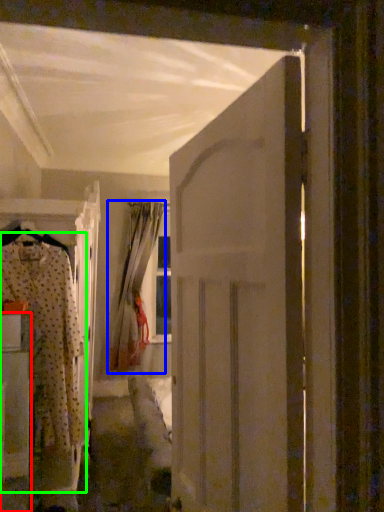
Question: Which object is the closest to the furniture (highlighted by a red box)? Choose among these: curtain (highlighted by a blue box) or clothing (highlighted by a green box).

Choices:
 (A) curtain
 (B) clothing

Answer: (B)